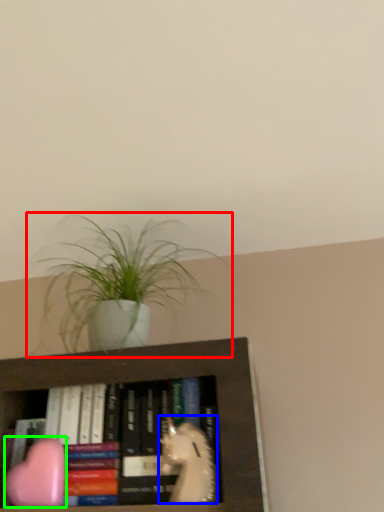
Question: Considering the real-world distances, which object is farthest from houseplant (highlighted by a red box)? animal (highlighted by a blue box) or animal (highlighted by a green box)?

Choices:
 (A) animal
 (B) animal

Answer: (A)